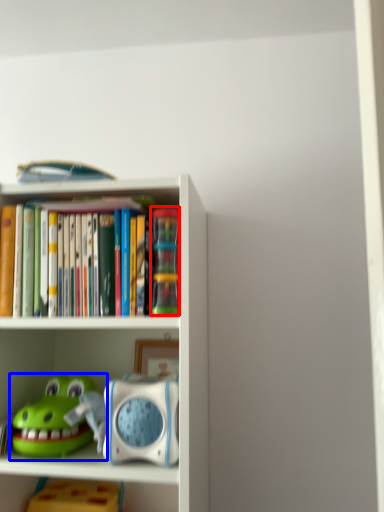
Question: Which object is further to the camera taking this photo, toy (highlighted by a red box) or toy (highlighted by a blue box)?

Choices:
 (A) toy
 (B) toy

Answer: (A)